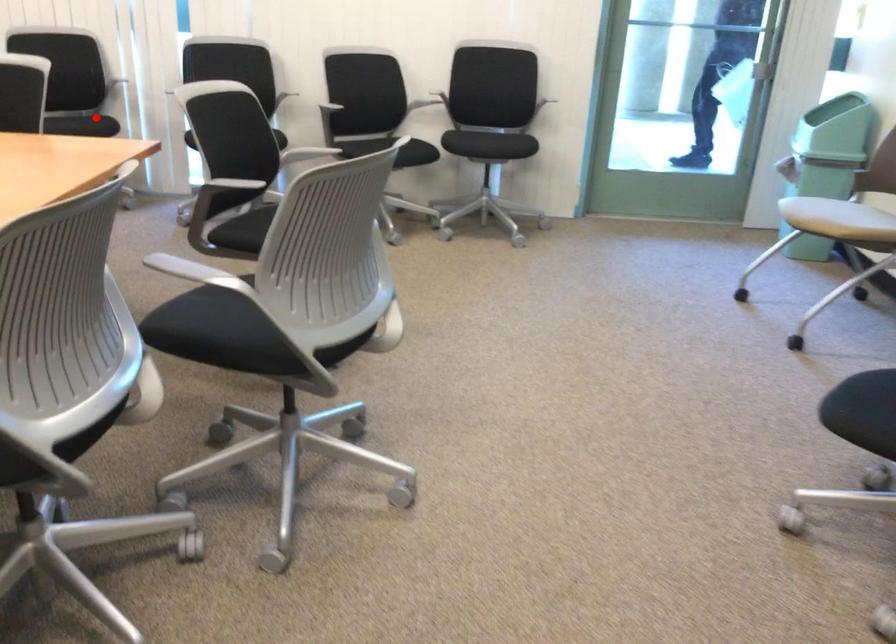
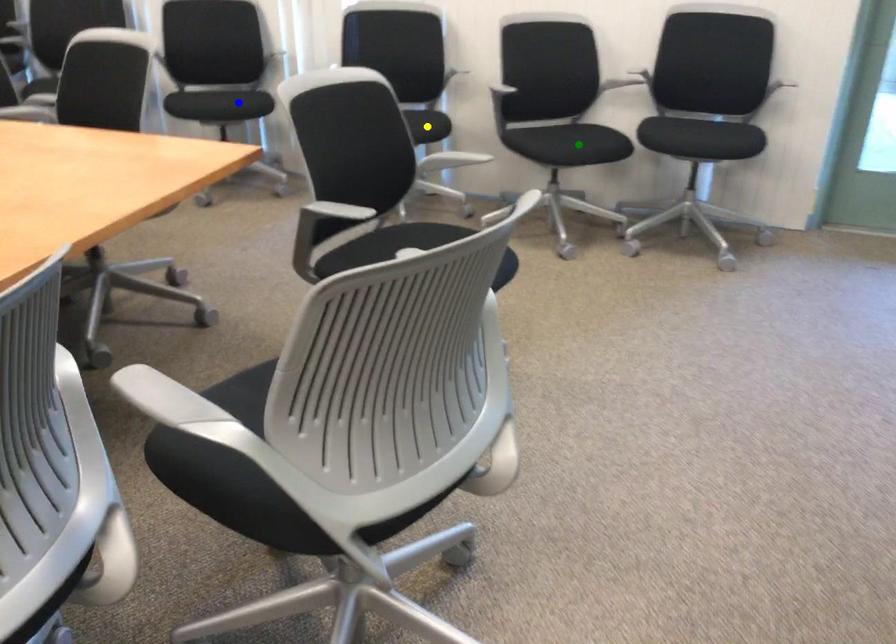
Question: I am providing you with two images of the same scene from different viewpoints. A red point is marked on the first image. You are given multiple points on the second image. In image 2, which mark is for the same physical point as the one in image 1?

Choices:
 (A) blue point
 (B) green point
 (C) yellow point

Answer: (A)